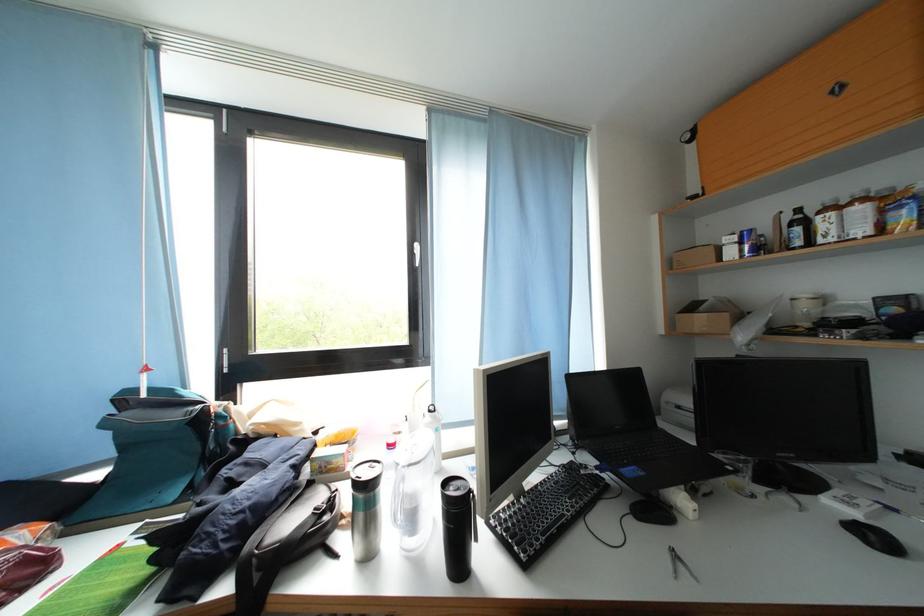
Where would you grasp the black thermos bottle? Please return your answer as a coordinate pair (x, y).

(457, 525)